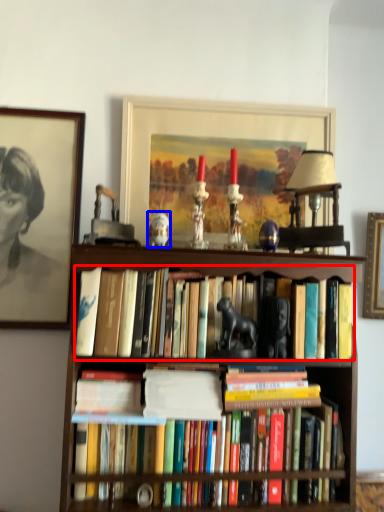
Question: Among these objects, which one is nearest to the camera, book (highlighted by a red box) or animal (highlighted by a blue box)?

Choices:
 (A) book
 (B) animal

Answer: (A)